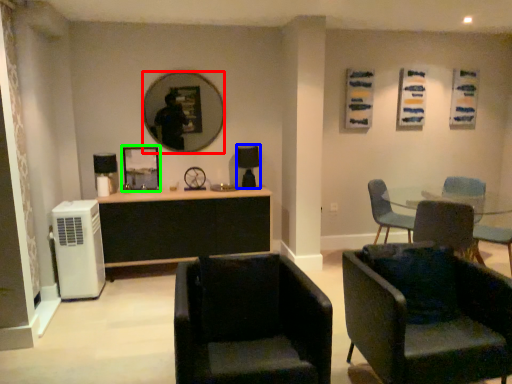
Question: Considering the real-world distances, which object is farthest from mirror (highlighted by a red box)? lamp (highlighted by a blue box) or picture frame (highlighted by a green box)?

Choices:
 (A) lamp
 (B) picture frame

Answer: (A)